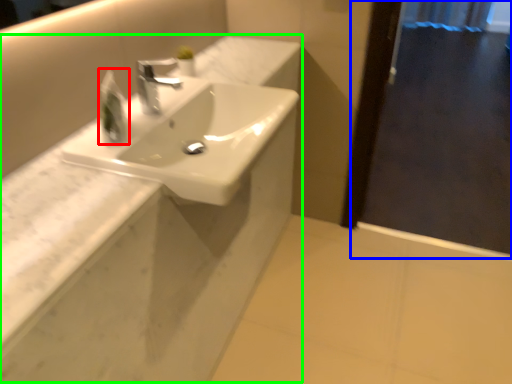
Question: Which is nearer to the soap dispenser (highlighted by a red box)? screen door (highlighted by a blue box) or counter (highlighted by a green box).

Choices:
 (A) screen door
 (B) counter

Answer: (B)